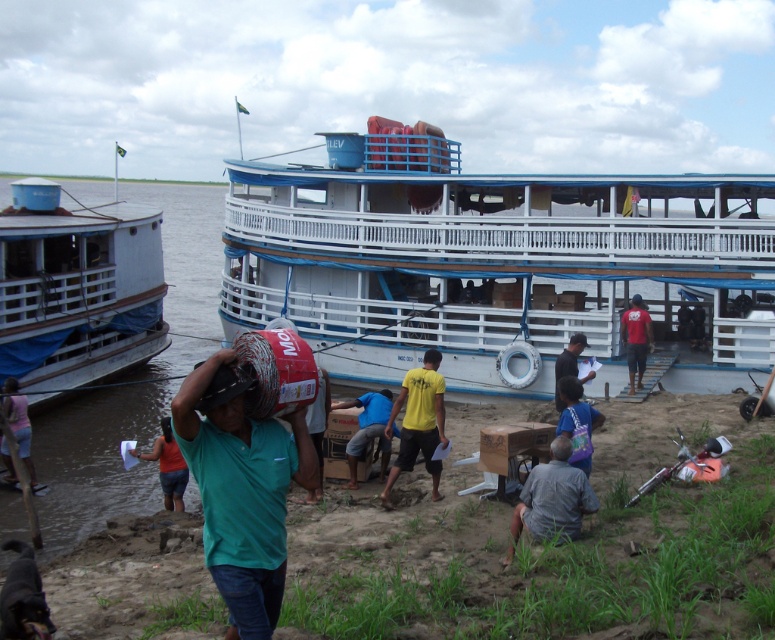
Is point (515, 544) closer to viewer compared to point (40, 483)?

Yes, it is in front of point (40, 483).

Where is `gray cotton shirt at lower center`? gray cotton shirt at lower center is located at coordinates (553, 499).

The height and width of the screenshot is (640, 775). In order to click on gray cotton shirt at lower center in this screenshot , I will do `click(553, 499)`.

Can you confirm if white matte boat at center is taller than gray cotton shirt at lower center?

Yes, white matte boat at center is taller than gray cotton shirt at lower center.

Does white matte boat at center appear over gray cotton shirt at lower center?

Indeed, white matte boat at center is positioned over gray cotton shirt at lower center.

At what (x,y) coordinates should I click in order to perform the action: click on white matte boat at center. Please return your answer as a coordinate pair (x, y). The width and height of the screenshot is (775, 640). Looking at the image, I should click on (488, 260).

Identify the location of white matte boat at center. The image size is (775, 640). (488, 260).

Is blue fabric shirt at center thinner than light pink fabric at lower left?

No, blue fabric shirt at center is not thinner than light pink fabric at lower left.

Image resolution: width=775 pixels, height=640 pixels. What do you see at coordinates (369, 429) in the screenshot?
I see `blue fabric shirt at center` at bounding box center [369, 429].

This screenshot has height=640, width=775. Find the location of `blue fabric shirt at center`. blue fabric shirt at center is located at coordinates (369, 429).